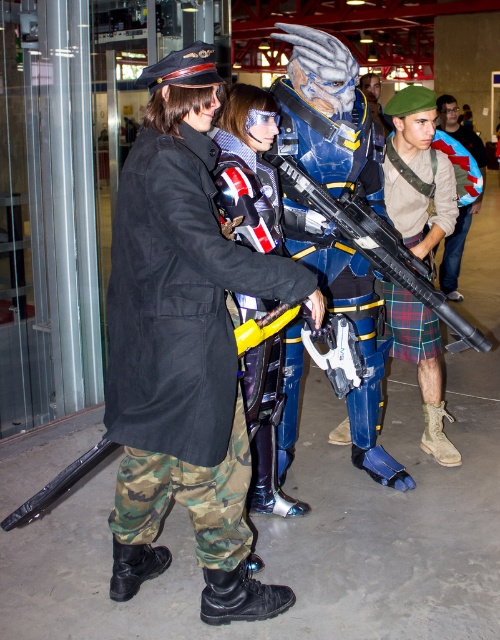
You are a photographer at this event and need to capture a photo that includes both the camouflage fabric pants at left and the shiny blue armor at center. Which object should be placed lower in the frame to ensure both are visible?

The camouflage fabric pants at left should be placed lower in the frame because it is positioned below the shiny blue armor at center, so adjusting their placement accordingly would ensure both are visible.

Looking at this image, you are a photographer at the event and need to capture a photo that includes both the camouflage fabric pants at left and the matte black rifle at center. Which object should you ensure is placed lower in the frame to include both in the shot?

The camouflage fabric pants at left is positioned under the matte black rifle at center, so to include both in the shot, ensure the camouflage fabric pants at left is placed lower in the frame.